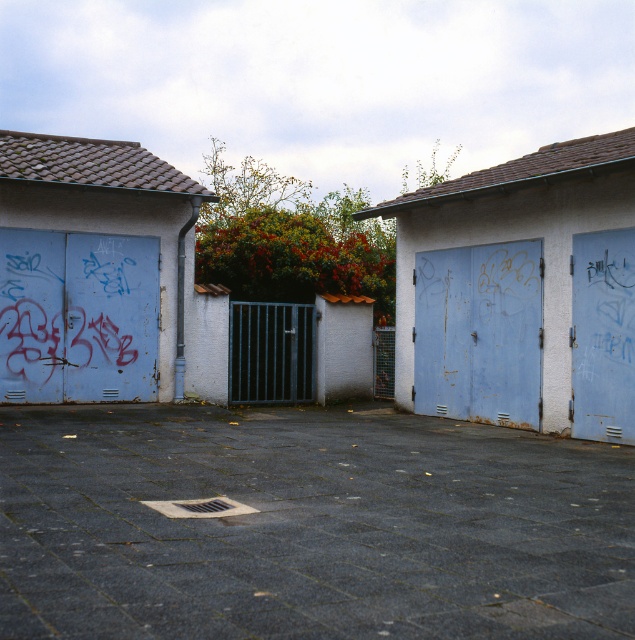
Question: Among these objects, which one is farthest from the camera?

Choices:
 (A) rusty metal garage door at left
 (B) metallic gate at center
 (C) rusty metal door at right

Answer: (B)

Question: Which point is closer to the camera?

Choices:
 (A) (490, 416)
 (B) (231, 326)
 (C) (90, 352)
 (D) (131, 339)

Answer: (A)

Question: Which object appears farthest from the camera in this image?

Choices:
 (A) rusty blue door at center
 (B) rusty metal garage door at left

Answer: (B)

Question: Is rusty blue door at right below metallic gate at center?

Choices:
 (A) yes
 (B) no

Answer: (B)

Question: Observing the image, what is the correct spatial positioning of light blue painted metal garage door at left in reference to rusty metal garage door at left?

Choices:
 (A) above
 (B) below

Answer: (A)

Question: Is rusty metal garage door at left positioned in front of rusty blue door at center?

Choices:
 (A) no
 (B) yes

Answer: (A)